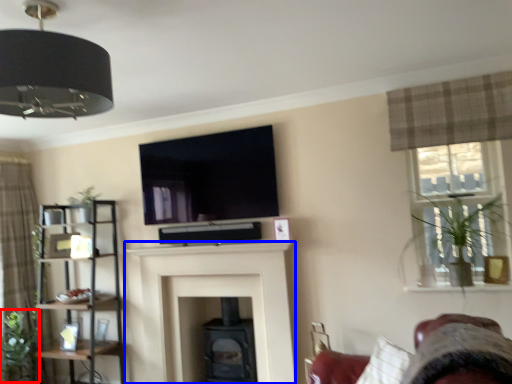
Question: Among these objects, which one is nearest to the camera, plant (highlighted by a red box) or fireplace (highlighted by a blue box)?

Choices:
 (A) plant
 (B) fireplace

Answer: (B)